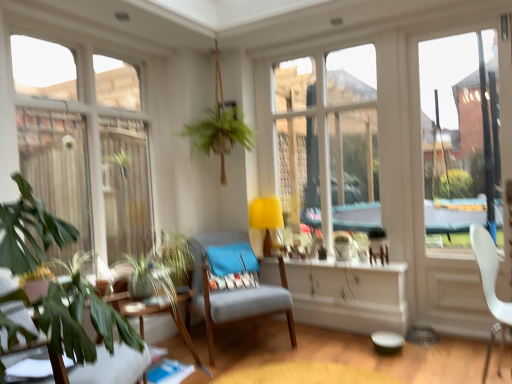
Find the location of `vacant space situated above transparent glass door at right (from a real-world perspective)`. vacant space situated above transparent glass door at right (from a real-world perspective) is located at coordinates (461, 19).